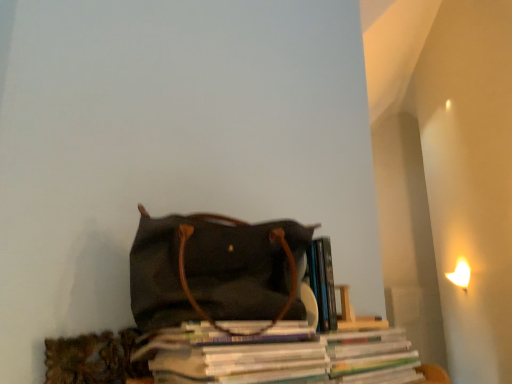
Question: From their relative heights in the image, would you say white glossy magazine at center is taller or shorter than canvas handbag at center?

Choices:
 (A) short
 (B) tall

Answer: (A)

Question: Is white glossy magazine at center in front of or behind canvas handbag at center in the image?

Choices:
 (A) behind
 (B) front

Answer: (B)

Question: Considering the positions of white glossy magazine at center and canvas handbag at center in the image, is white glossy magazine at center wider or thinner than canvas handbag at center?

Choices:
 (A) wide
 (B) thin

Answer: (B)

Question: Looking at their shapes, would you say canvas handbag at center is wider or thinner than white glossy magazine at center?

Choices:
 (A) wide
 (B) thin

Answer: (A)

Question: Is canvas handbag at center bigger or smaller than white glossy magazine at center?

Choices:
 (A) big
 (B) small

Answer: (A)

Question: Considering their positions, is canvas handbag at center located in front of or behind white glossy magazine at center?

Choices:
 (A) front
 (B) behind

Answer: (B)

Question: Visually, is canvas handbag at center positioned to the left or to the right of white glossy magazine at center?

Choices:
 (A) left
 (B) right

Answer: (A)